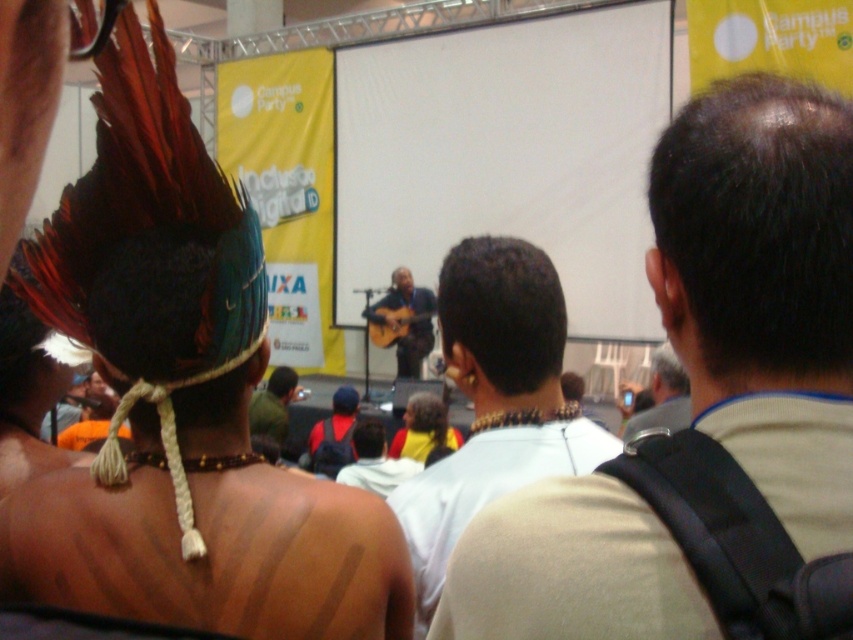
Question: Is dark brown hair at center below smooth brown guitar at center?

Choices:
 (A) no
 (B) yes

Answer: (B)

Question: Can you confirm if smooth brown guitar at center is positioned below acoustic guitar at center?

Choices:
 (A) no
 (B) yes

Answer: (B)

Question: Which object is the farthest from the light brown hair at center?

Choices:
 (A) smooth brown guitar at center
 (B) dark brown leather jacket at center
 (C) feathered headdress at upper left
 (D) light brown leather jacket at upper right

Answer: (A)

Question: Among these objects, which one is nearest to the camera?

Choices:
 (A) acoustic guitar at center
 (B) reddish-brown fabric cap at center
 (C) light brown hair at center

Answer: (C)

Question: Which object appears closest to the camera in this image?

Choices:
 (A) dark brown leather jacket at center
 (B) light brown hair at center

Answer: (B)

Question: Can you confirm if smooth brown guitar at center is bigger than light brown leather jacket at upper right?

Choices:
 (A) yes
 (B) no

Answer: (A)